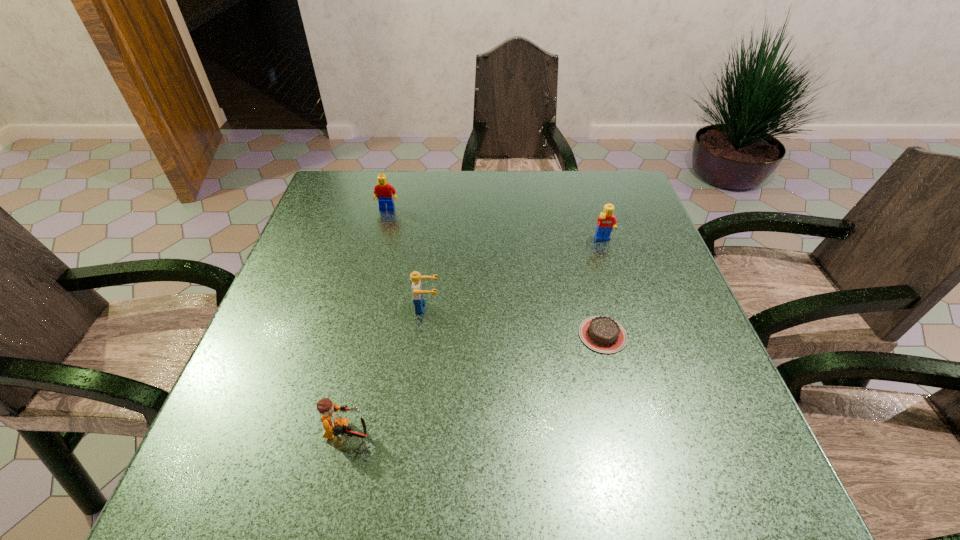
The image size is (960, 540). In the image, there is a desktop. Find the location of `free space at the far right corner`. free space at the far right corner is located at coordinates (596, 207).

Find the location of a particular element. The height and width of the screenshot is (540, 960). unoccupied area between the farthest Lego and the third nearest object is located at coordinates (407, 258).

Find the location of `free space between the chocolate cake and the third nearest Lego`. free space between the chocolate cake and the third nearest Lego is located at coordinates (603, 288).

You are a GUI agent. You are given a task and a screenshot of the screen. Output one action in this format:
    pyautogui.click(x=<x>, y=<y>)
    Task: Click on the vacant area that lies between the chocolate cake and the farthest object
    
    Given the screenshot: What is the action you would take?
    pyautogui.click(x=495, y=272)

Locate an element on the screen. free space between the second farthest object and the third Lego from left to right is located at coordinates (516, 274).

At what (x,y) coordinates should I click in order to perform the action: click on unoccupied area between the farthest object and the chocolate cake. Please return your answer as a coordinate pair (x, y). This screenshot has width=960, height=540. Looking at the image, I should click on (495, 272).

Locate an element on the screen. vacant point located between the farthest object and the nearest Lego is located at coordinates (368, 322).

Where is `free space between the farthest Lego and the third object from right to left`? This screenshot has width=960, height=540. free space between the farthest Lego and the third object from right to left is located at coordinates (407, 258).

Where is `empty space that is in between the second farthest object and the nearest object`? This screenshot has height=540, width=960. empty space that is in between the second farthest object and the nearest object is located at coordinates coord(475,338).

Where is `free space between the rightmost Lego and the second Lego from right to left`? The height and width of the screenshot is (540, 960). free space between the rightmost Lego and the second Lego from right to left is located at coordinates (516, 274).